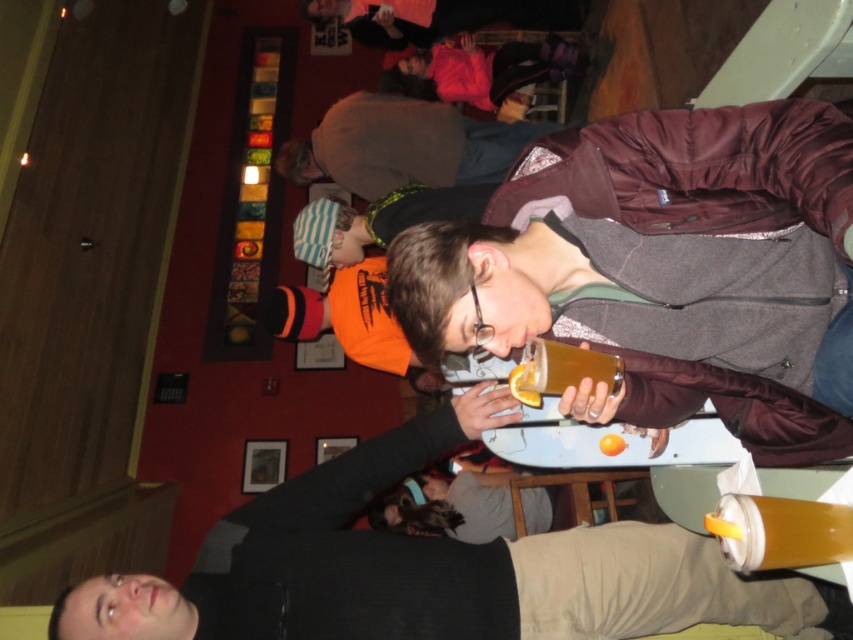
Question: Which point is farther to the camera?

Choices:
 (A) (573, 380)
 (B) (839, 529)

Answer: (A)

Question: Can you confirm if translucent plastic cup at lower right is wider than translucent plastic cup at upper center?

Choices:
 (A) yes
 (B) no

Answer: (A)

Question: Does translucent plastic cup at lower right have a larger size compared to translucent plastic cup at upper center?

Choices:
 (A) yes
 (B) no

Answer: (B)

Question: Can you confirm if translucent plastic cup at lower right is positioned above translucent plastic cup at upper center?

Choices:
 (A) no
 (B) yes

Answer: (A)